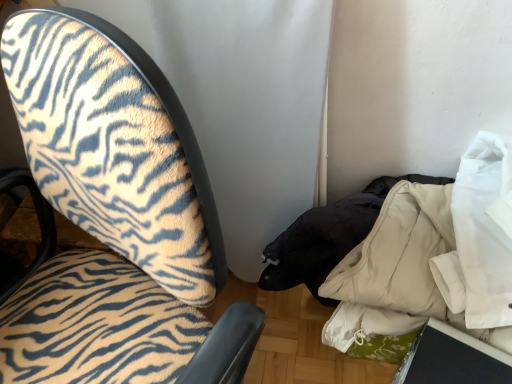
Measure the distance between point (50, 338) and camera.

28.27 inches.

Describe the element at coordinates (115, 218) in the screenshot. I see `tiger print fabric chair at center` at that location.

The image size is (512, 384). In order to click on tiger print fabric chair at center in this screenshot , I will do `click(115, 218)`.

You are a GUI agent. You are given a task and a screenshot of the screen. Output one action in this format:
    pyautogui.click(x=<x>, y=<y>)
    Task: Click on the tiger print fabric chair at center
    
    Given the screenshot: What is the action you would take?
    pyautogui.click(x=115, y=218)